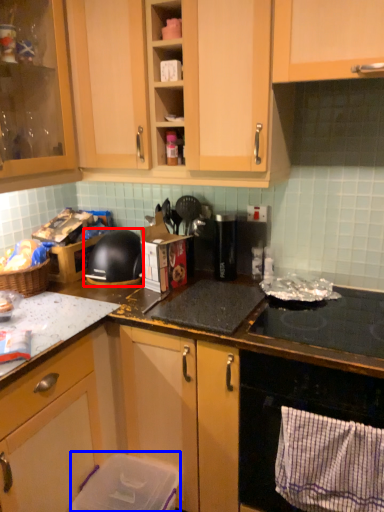
Question: Among these objects, which one is farthest to the camera, kitchen appliance (highlighted by a red box) or appliance (highlighted by a blue box)?

Choices:
 (A) kitchen appliance
 (B) appliance

Answer: (A)